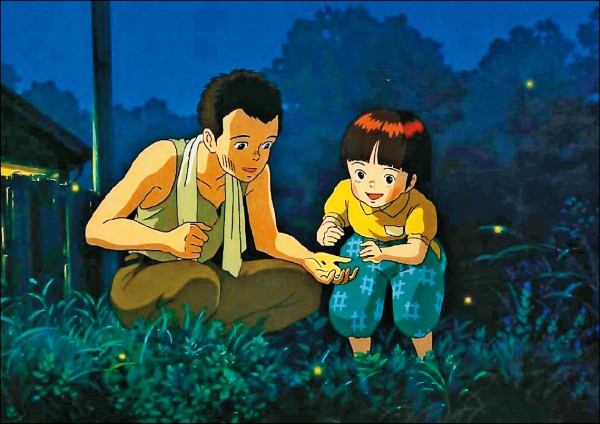
Locate an element on the screen. towel is located at coordinates (239, 235).